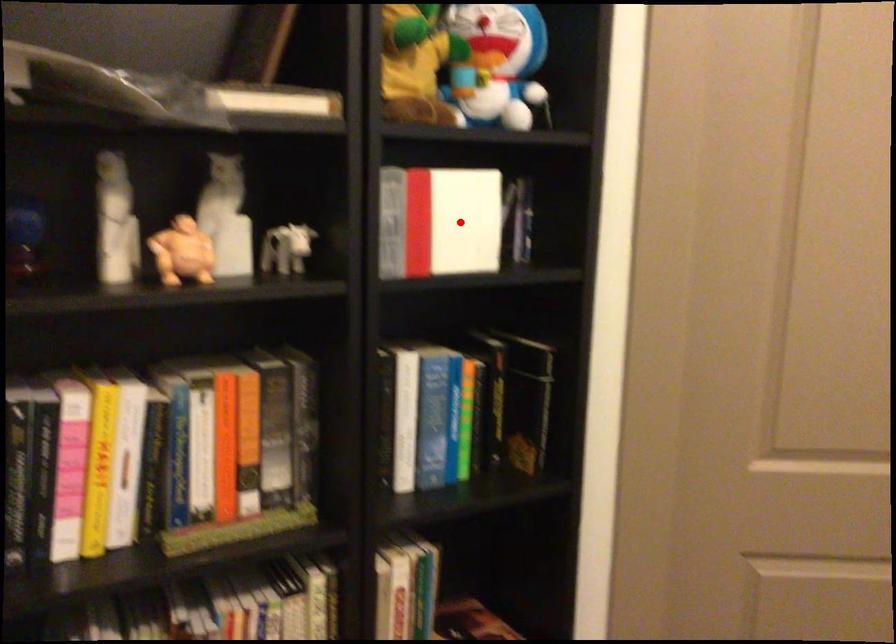
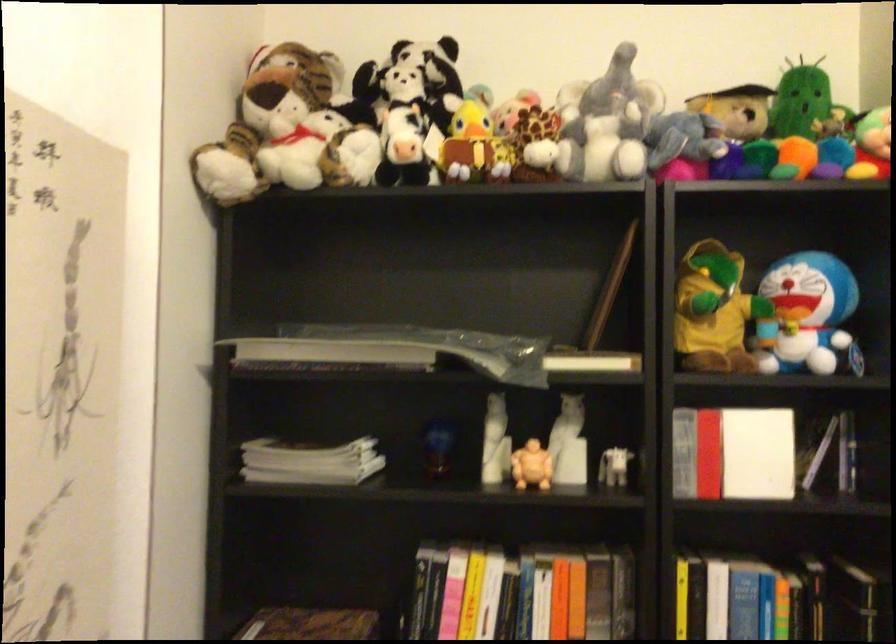
Question: A red point is marked in image1. In image2, is the corresponding 3D point closer to the camera or farther? Reply with the corresponding letter.

Choices:
 (A) The corresponding 3D point is closer.
 (B) The corresponding 3D point is farther.

Answer: (B)